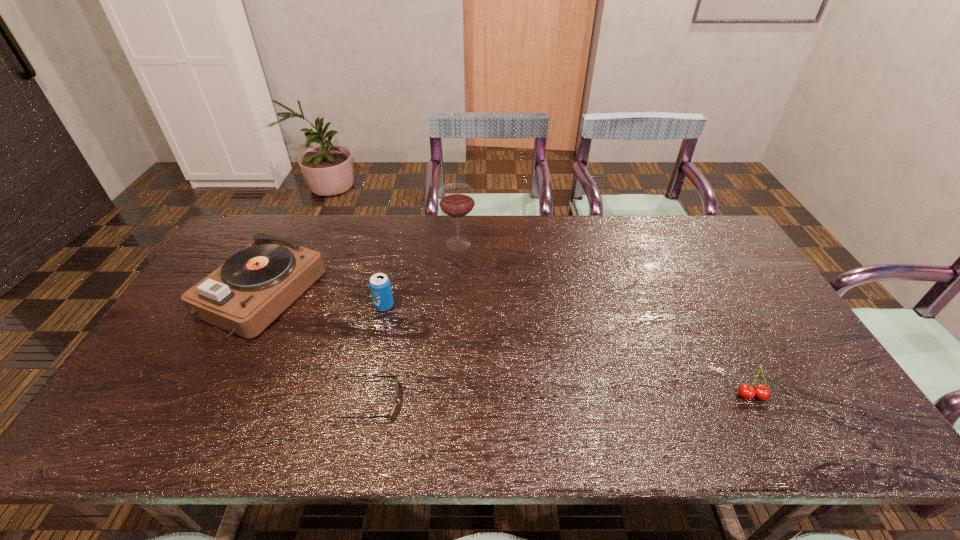
The width and height of the screenshot is (960, 540). Find the location of `vacant region between the shortest object and the record player`. vacant region between the shortest object and the record player is located at coordinates pos(318,348).

This screenshot has height=540, width=960. Find the location of `object that can be found as the second closest to the tallest object`. object that can be found as the second closest to the tallest object is located at coordinates (244, 295).

Select which object appears as the closest to the record player. Please provide its 2D coordinates. Your answer should be formatted as a tuple, i.e. [(x, y)], where the tuple contains the x and y coordinates of a point satisfying the conditions above.

[(380, 287)]

You are a GUI agent. You are given a task and a screenshot of the screen. Output one action in this format:
    pyautogui.click(x=<x>, y=<y>)
    Task: Click on the free space that satisfies the following two spatial constraints: 1. with the stems of the cherry pointing upwards; 2. on the front-facing side of the sunglasses
    This screenshot has height=540, width=960.
    Given the screenshot: What is the action you would take?
    pyautogui.click(x=755, y=401)

This screenshot has width=960, height=540. Find the location of `free space that satisfies the following two spatial constraints: 1. with the stems of the rightmost object pointing upwards; 2. on the front-facing side of the sunglasses`. free space that satisfies the following two spatial constraints: 1. with the stems of the rightmost object pointing upwards; 2. on the front-facing side of the sunglasses is located at coordinates (755, 401).